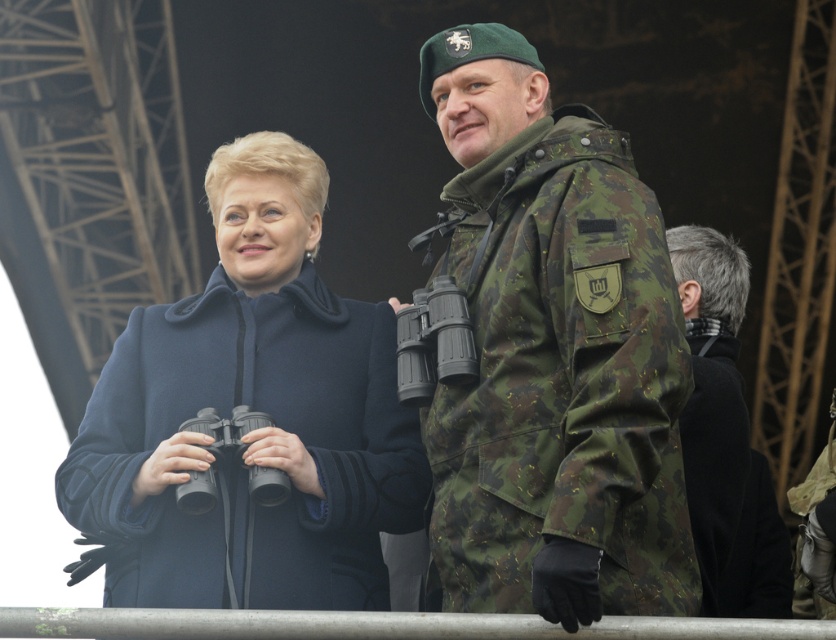
You are a photographer trying to capture a photo of both the dark blue wool coat at center and the black wool coat at right. Since you want both coats to be clearly visible in the photo, which coat should you focus on first to ensure it is in sharp focus?

The dark blue wool coat at center is in front of the black wool coat at right, so you should focus on the dark blue wool coat at center first to ensure both are in focus as the background coat will naturally be less sharp.

You are standing in front of the two people in the image and want to place a small flag at the point closer to you. Which point should you choose between point (630, 374) and point (370, 362)?

You should choose point (630, 374) because it is closer to the viewer than point (370, 362).

You are a photographer trying to capture a clear shot of the camo fabric binoculars at right. The camera you are using has a focus point at coordinate point (553, 355). Will this focus point align with the camo fabric binoculars at right?

Yes, the focus point at coordinate point (553, 355) aligns with the camo fabric binoculars at right because the Objects Description states that this point corresponds to them.